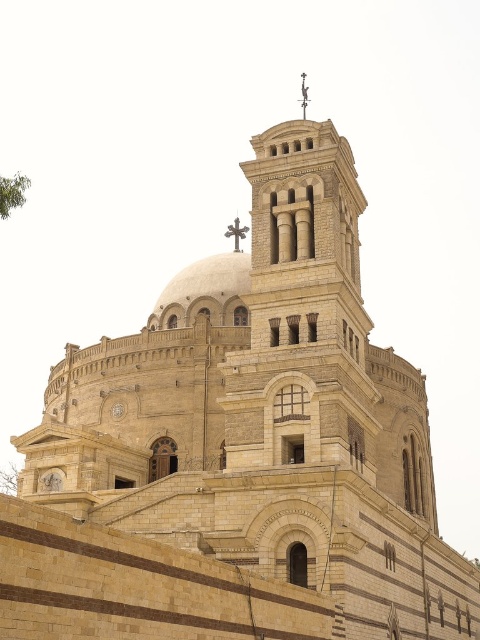
Question: Does beige stone dome at center have a larger size compared to metallic cross at upper center?

Choices:
 (A) yes
 (B) no

Answer: (A)

Question: Which point is closer to the camera?

Choices:
 (A) (229, 227)
 (B) (220, 301)

Answer: (B)

Question: Can you confirm if beige stone dome at center is positioned to the right of metallic cross at upper center?

Choices:
 (A) yes
 (B) no

Answer: (B)

Question: In this image, where is beige stone dome at center located relative to metallic cross at upper center?

Choices:
 (A) right
 (B) left

Answer: (B)

Question: Which of the following is the farthest from the observer?

Choices:
 (A) (244, 227)
 (B) (172, 301)

Answer: (A)